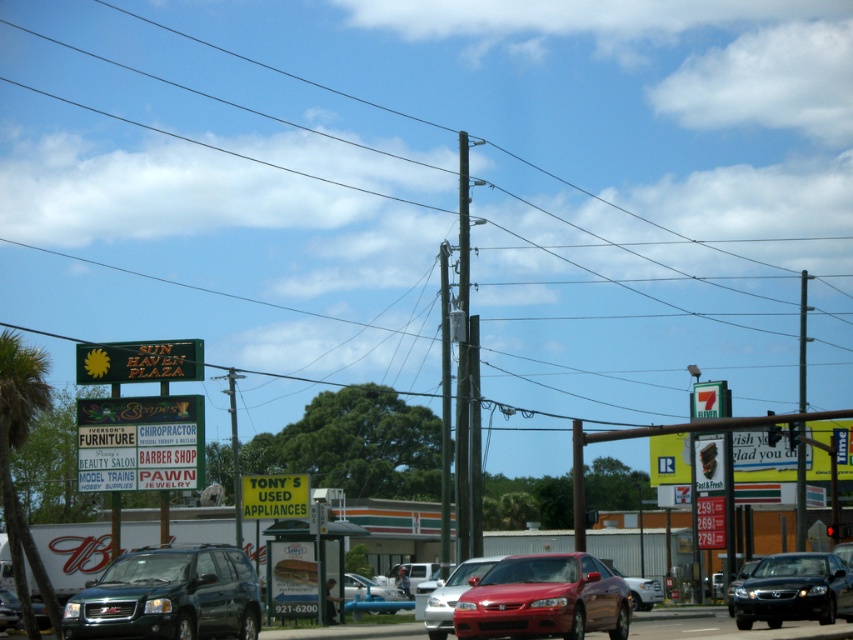
You are driving a metallic blue car at center and want to read the green plastic signboard at center. Can you see the entire signboard from your current position?

The green plastic signboard at center might be wider than metallic blue car at center, so it is possible that part of the signboard is blocked from your view. You might need to move closer or adjust your position to see the entire signboard.

Looking at this image, you are a city planner assessing the street layout. The green wooden pole at center and the green plastic sign at upper left are both in the way of a new sidewalk. Which object requires more space to be moved due to its size?

The green wooden pole at center requires more space to be moved because its width surpasses that of the green plastic sign at upper left.